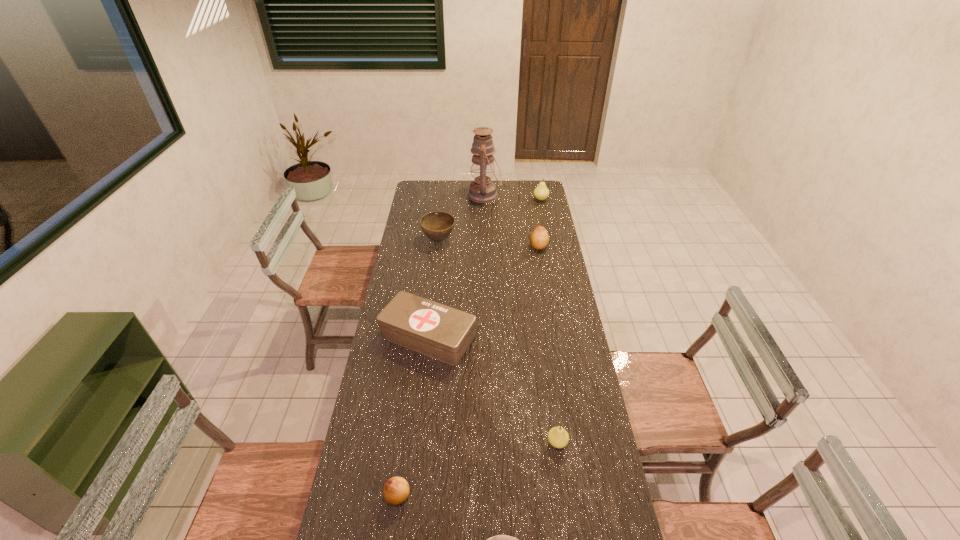
Find the location of `oil lamp at the far edge`. oil lamp at the far edge is located at coordinates pos(482,190).

Locate an element on the screen. This screenshot has width=960, height=540. pear that is at the far edge is located at coordinates (541, 192).

Where is `bowl situated at the left edge`? The height and width of the screenshot is (540, 960). bowl situated at the left edge is located at coordinates (437, 226).

This screenshot has width=960, height=540. I want to click on the first-aid kit that is at the left edge, so click(436, 330).

The height and width of the screenshot is (540, 960). Find the location of `pear that is positioned at the left edge`. pear that is positioned at the left edge is located at coordinates (396, 490).

Identify the location of object located at the far right corner. This screenshot has height=540, width=960. point(541,192).

Find the location of a particular element. The height and width of the screenshot is (540, 960). blank area at the far edge is located at coordinates (462, 186).

Locate an element on the screen. free space at the left edge of the desktop is located at coordinates (393, 287).

This screenshot has height=540, width=960. Identify the location of vacant space at the right edge. (535, 271).

Locate an element on the screen. The image size is (960, 540). vacant region at the far left corner is located at coordinates (436, 185).